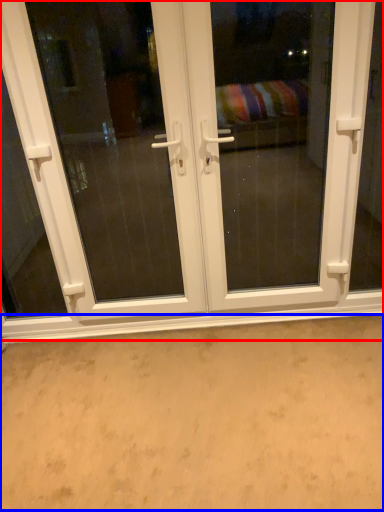
Question: Which point is closer to the camera, door (highlighted by a red box) or plain (highlighted by a blue box)?

Choices:
 (A) door
 (B) plain

Answer: (B)